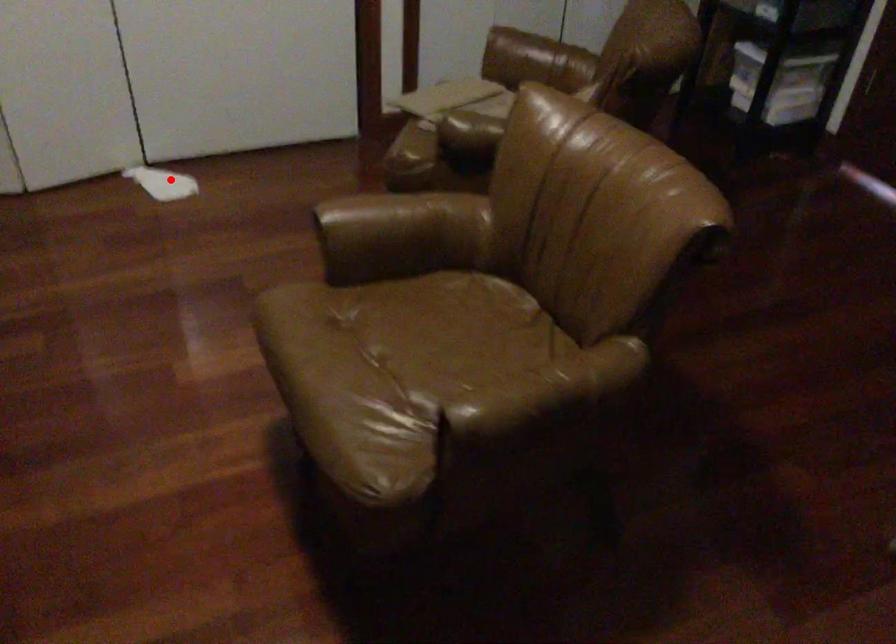
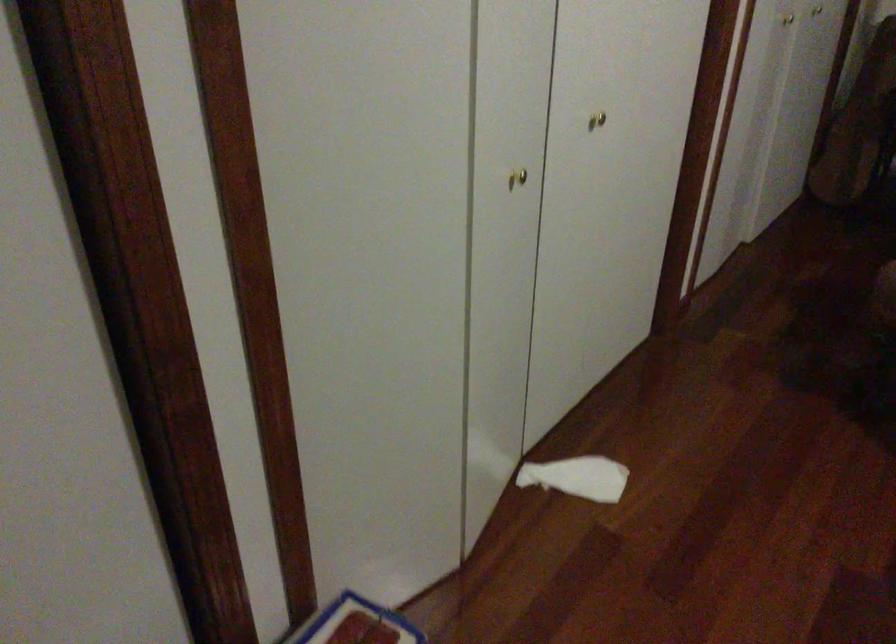
Question: I am providing you with two images of the same scene from different viewpoints. Given a red point in image1, look at the same physical point in image2. Is it:

Choices:
 (A) Closer to the viewpoint
 (B) Farther from the viewpoint

Answer: (A)